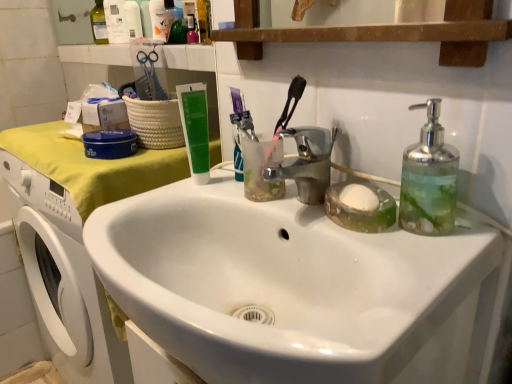
Question: Should I look upward or downward to see clear glass soap dispenser at right?

Choices:
 (A) up
 (B) down

Answer: (A)

Question: Is the depth of chrome metallic faucet at center less than that of green matte tube at upper center?

Choices:
 (A) yes
 (B) no

Answer: (A)

Question: From a real-world perspective, is chrome metallic faucet at center positioned over green matte tube at upper center based on gravity?

Choices:
 (A) no
 (B) yes

Answer: (A)

Question: Does chrome metallic faucet at center lie behind green matte tube at upper center?

Choices:
 (A) no
 (B) yes

Answer: (A)

Question: Does chrome metallic faucet at center appear on the left side of green matte tube at upper center?

Choices:
 (A) no
 (B) yes

Answer: (A)

Question: Is chrome metallic faucet at center oriented towards green matte tube at upper center?

Choices:
 (A) yes
 (B) no

Answer: (B)

Question: From the image's perspective, is chrome metallic faucet at center on top of green matte tube at upper center?

Choices:
 (A) no
 (B) yes

Answer: (A)

Question: Considering the relative sizes of chrome metallic faucet at center and white plastic bottle at upper left, the second toiletry from the back, in the image provided, is chrome metallic faucet at center thinner than white plastic bottle at upper left, the second toiletry from the back,?

Choices:
 (A) yes
 (B) no

Answer: (B)

Question: Is the depth of chrome metallic faucet at center greater than that of white plastic bottle at upper left, the second toiletry from the back?

Choices:
 (A) no
 (B) yes

Answer: (A)

Question: Is chrome metallic faucet at center facing away from white plastic bottle at upper left, acting as the 2th toiletry starting from the front?

Choices:
 (A) no
 (B) yes

Answer: (A)

Question: Is chrome metallic faucet at center touching white plastic bottle at upper left, the second toiletry from the back?

Choices:
 (A) yes
 (B) no

Answer: (B)

Question: Is chrome metallic faucet at center to the left of white plastic bottle at upper left, acting as the 2th toiletry starting from the front, from the viewer's perspective?

Choices:
 (A) yes
 (B) no

Answer: (B)

Question: From the image's perspective, is chrome metallic faucet at center above white plastic bottle at upper left, acting as the 2th toiletry starting from the front?

Choices:
 (A) yes
 (B) no

Answer: (B)

Question: From the image's perspective, is clear glass soap dispenser at right on green matte tube at upper center?

Choices:
 (A) no
 (B) yes

Answer: (A)